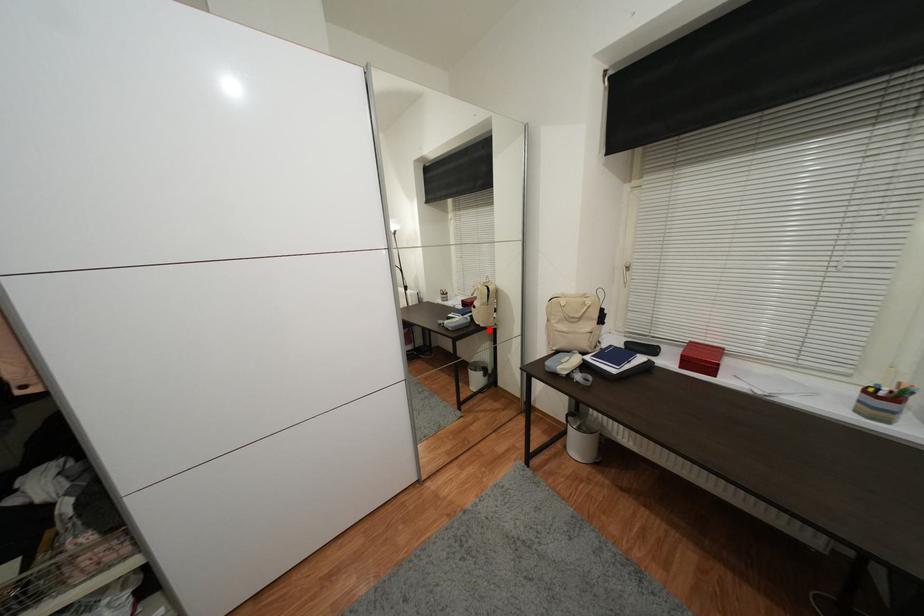
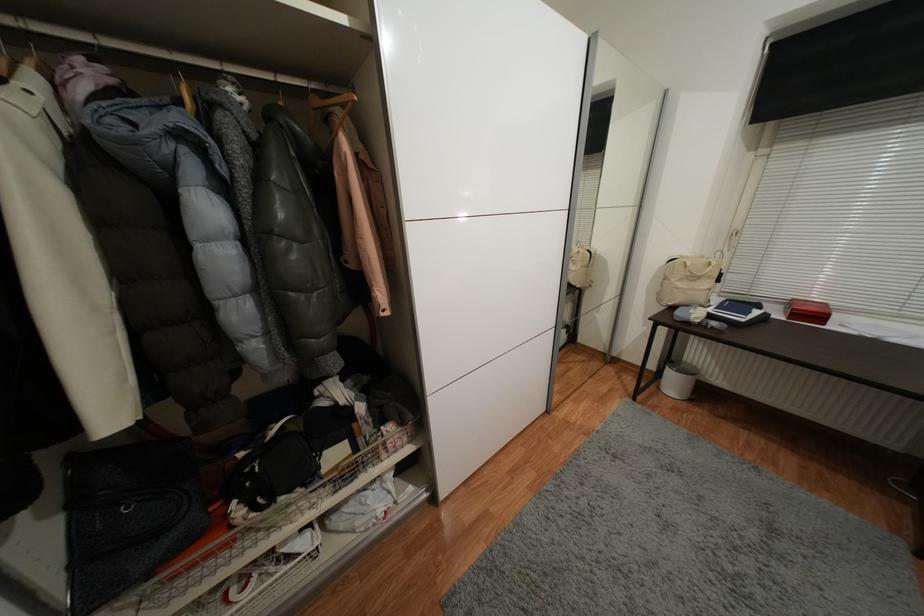
In the second image, find the point that corresponds to the highlighted location in the first image.

(582, 291)